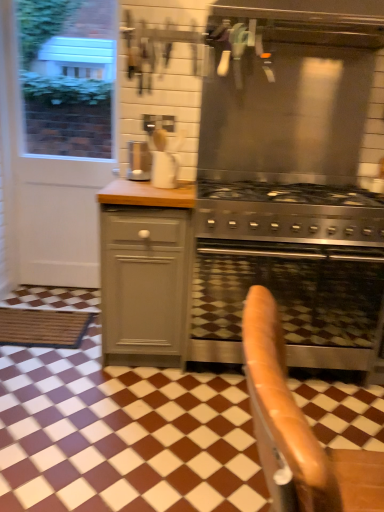
Question: Considering the relative positions of white matte paper towel at center and stainless steel vent at upper center in the image provided, is white matte paper towel at center to the right of stainless steel vent at upper center from the viewer's perspective?

Choices:
 (A) no
 (B) yes

Answer: (A)

Question: Is stainless steel vent at upper center inside white matte paper towel at center?

Choices:
 (A) no
 (B) yes

Answer: (A)

Question: From a real-world perspective, is white matte paper towel at center below stainless steel vent at upper center?

Choices:
 (A) no
 (B) yes

Answer: (B)

Question: Can you confirm if white matte paper towel at center is bigger than stainless steel vent at upper center?

Choices:
 (A) no
 (B) yes

Answer: (A)

Question: From a real-world perspective, is white matte paper towel at center on top of stainless steel vent at upper center?

Choices:
 (A) no
 (B) yes

Answer: (A)

Question: Is white matte paper towel at center completely or partially outside of stainless steel vent at upper center?

Choices:
 (A) yes
 (B) no

Answer: (A)

Question: Is the position of white matte paper towel at center less distant than that of leather armchair at center?

Choices:
 (A) no
 (B) yes

Answer: (A)

Question: Is white matte paper towel at center taller than leather armchair at center?

Choices:
 (A) yes
 (B) no

Answer: (B)

Question: Considering the relative sizes of white matte paper towel at center and leather armchair at center in the image provided, is white matte paper towel at center thinner than leather armchair at center?

Choices:
 (A) yes
 (B) no

Answer: (A)

Question: From a real-world perspective, is white matte paper towel at center on leather armchair at center?

Choices:
 (A) no
 (B) yes

Answer: (B)

Question: Considering the relative sizes of white matte paper towel at center and leather armchair at center in the image provided, is white matte paper towel at center shorter than leather armchair at center?

Choices:
 (A) no
 (B) yes

Answer: (B)

Question: Does white matte paper towel at center appear on the right side of leather armchair at center?

Choices:
 (A) yes
 (B) no

Answer: (B)

Question: Can you confirm if stainless steel vent at upper center is bigger than stainless steel oven at center?

Choices:
 (A) no
 (B) yes

Answer: (B)